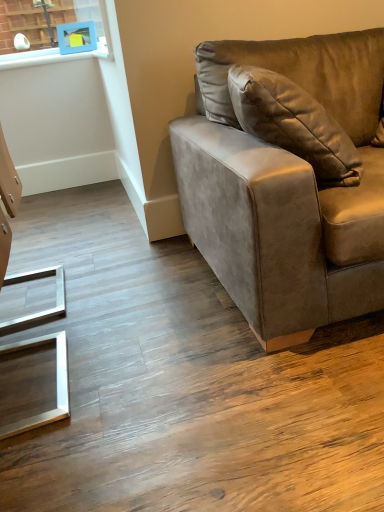
Question: Is blue plastic picture frame at upper left in front of suede-like brown couch at right?

Choices:
 (A) yes
 (B) no

Answer: (B)

Question: From a real-world perspective, does blue plastic picture frame at upper left sit lower than suede-like brown couch at right?

Choices:
 (A) no
 (B) yes

Answer: (A)

Question: Is blue plastic picture frame at upper left outside suede-like brown couch at right?

Choices:
 (A) yes
 (B) no

Answer: (A)

Question: Is blue plastic picture frame at upper left oriented towards suede-like brown couch at right?

Choices:
 (A) yes
 (B) no

Answer: (B)

Question: Does blue plastic picture frame at upper left lie behind suede-like brown couch at right?

Choices:
 (A) yes
 (B) no

Answer: (A)

Question: From the image's perspective, is blue plastic picture frame at upper left located beneath suede-like brown couch at right?

Choices:
 (A) yes
 (B) no

Answer: (B)

Question: Is blue plastic picture frame at upper left a part of suede-like brown couch at right?

Choices:
 (A) no
 (B) yes

Answer: (A)

Question: Is suede-like brown couch at right behind blue plastic picture frame at upper left?

Choices:
 (A) yes
 (B) no

Answer: (B)

Question: Is suede-like brown couch at right closer to the viewer compared to blue plastic picture frame at upper left?

Choices:
 (A) no
 (B) yes

Answer: (B)

Question: Does suede-like brown couch at right have a lesser width compared to blue plastic picture frame at upper left?

Choices:
 (A) no
 (B) yes

Answer: (A)

Question: Is suede-like brown couch at right taller than blue plastic picture frame at upper left?

Choices:
 (A) no
 (B) yes

Answer: (B)

Question: Does suede-like brown couch at right have a smaller size compared to blue plastic picture frame at upper left?

Choices:
 (A) no
 (B) yes

Answer: (A)

Question: From a real-world perspective, is suede-like brown couch at right physically located above or below blue plastic picture frame at upper left?

Choices:
 (A) above
 (B) below

Answer: (B)